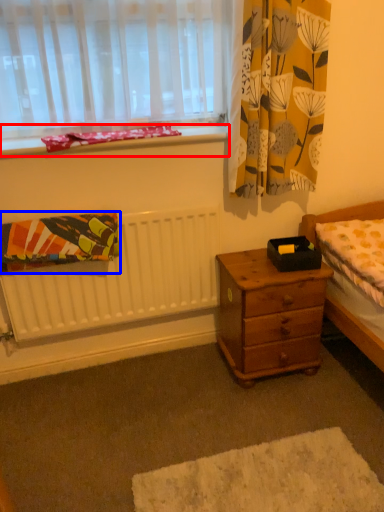
Question: Which of the following is the closest to the observer, window sill (highlighted by a red box) or blanket (highlighted by a blue box)?

Choices:
 (A) window sill
 (B) blanket

Answer: (B)